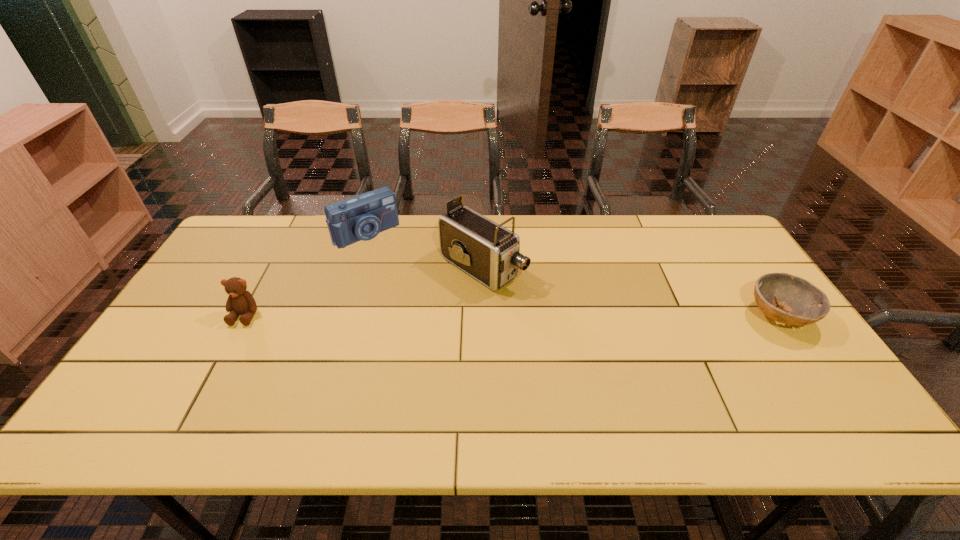
Locate an element on the screen. This screenshot has height=540, width=960. free space between the second shortest object and the camera is located at coordinates (305, 274).

At what (x,y) coordinates should I click in order to perform the action: click on empty location between the third object from left to right and the second object from left to right. Please return your answer as a coordinate pair (x, y). Looking at the image, I should click on pos(424,250).

This screenshot has width=960, height=540. Identify the location of vacant area between the leftmost object and the second object from left to right. (305, 274).

Locate an element on the screen. Image resolution: width=960 pixels, height=540 pixels. unoccupied area between the rightmost object and the third object from left to right is located at coordinates (631, 292).

This screenshot has height=540, width=960. In order to click on object that is the second closest one to the shortest object in this screenshot , I will do `click(362, 217)`.

Locate which object is the closest to the tallest object. Please provide its 2D coordinates. Your answer should be formatted as a tuple, i.e. [(x, y)], where the tuple contains the x and y coordinates of a point satisfying the conditions above.

[(362, 217)]

Find the location of a particular element. This screenshot has width=960, height=540. free location that satisfies the following two spatial constraints: 1. on the front side of the camera; 2. on the right side of the rightmost object is located at coordinates pyautogui.click(x=340, y=316).

Identify the location of vacant region that satisfies the following two spatial constraints: 1. on the front side of the second object from left to right; 2. on the right side of the camcorder. (355, 267).